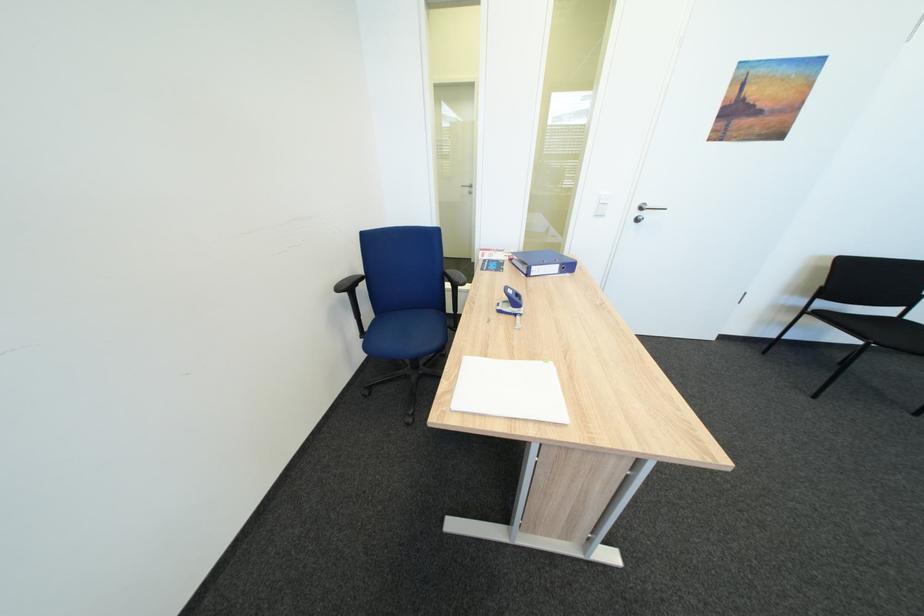
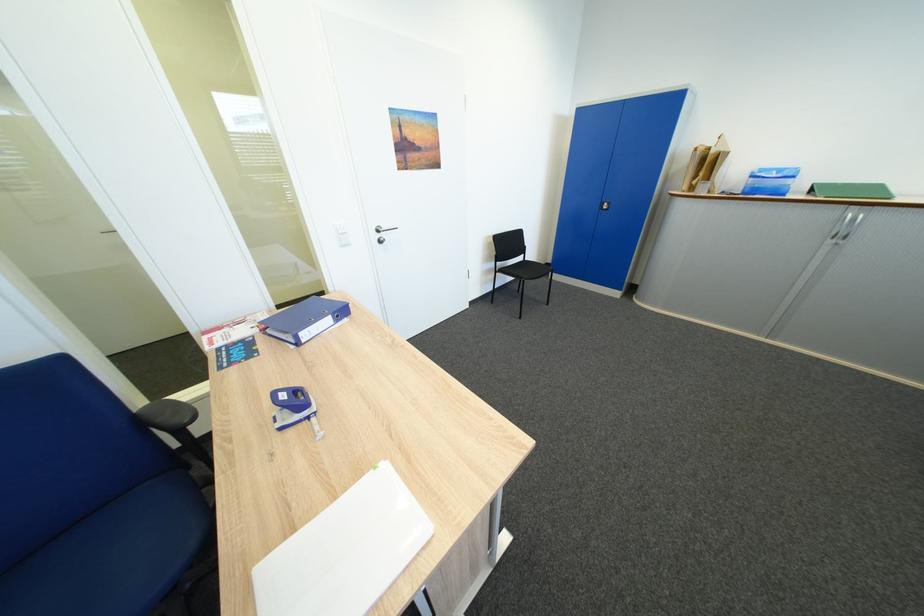
Question: The camera is either moving clockwise (left) or counter-clockwise (right) around the object. The first image is from the beginning of the video and the second image is from the end. Is the camera moving left or right when shooting the video?

Choices:
 (A) Left
 (B) Right

Answer: (A)